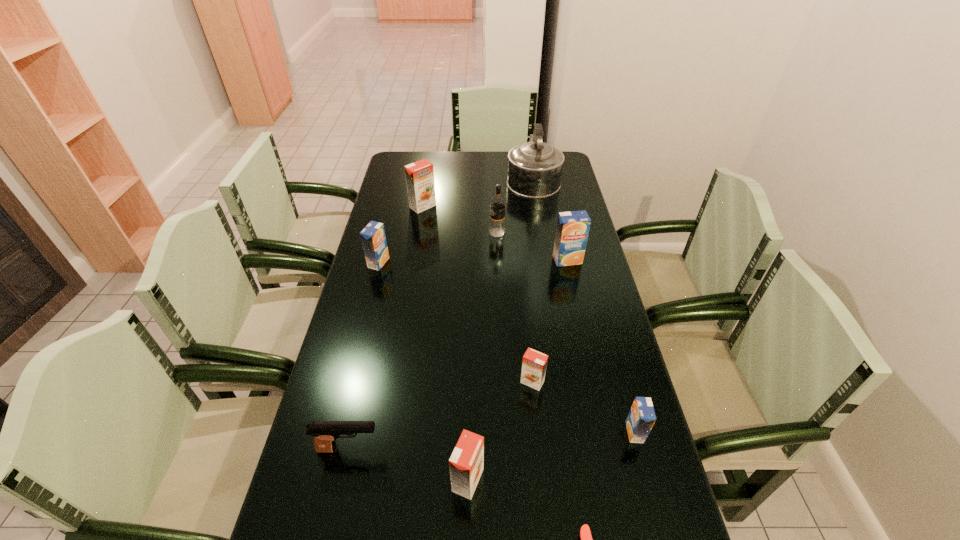
Identify which orange orange juice is located as the second nearest to the pistol. Please provide its 2D coordinates. Your answer should be formatted as a tuple, i.e. [(x, y)], where the tuple contains the x and y coordinates of a point satisfying the conditions above.

[(534, 364)]

At what (x,y) coordinates should I click in order to perform the action: click on blue orange_juice object that ranks as the closest to the orange hairbrush. Please return your answer as a coordinate pair (x, y). The width and height of the screenshot is (960, 540). Looking at the image, I should click on (641, 418).

Locate an element on the screen. This screenshot has width=960, height=540. the third closest blue orange_juice to the second nearest orange orange juice is located at coordinates (373, 238).

You are a GUI agent. You are given a task and a screenshot of the screen. Output one action in this format:
    pyautogui.click(x=<x>, y=<y>)
    Task: Click on the free region that satisfies the following two spatial constraints: 1. on the label of the second blue orange_juice from left to right; 2. on the left side of the third farthest object
    The width and height of the screenshot is (960, 540).
    Given the screenshot: What is the action you would take?
    pyautogui.click(x=498, y=260)